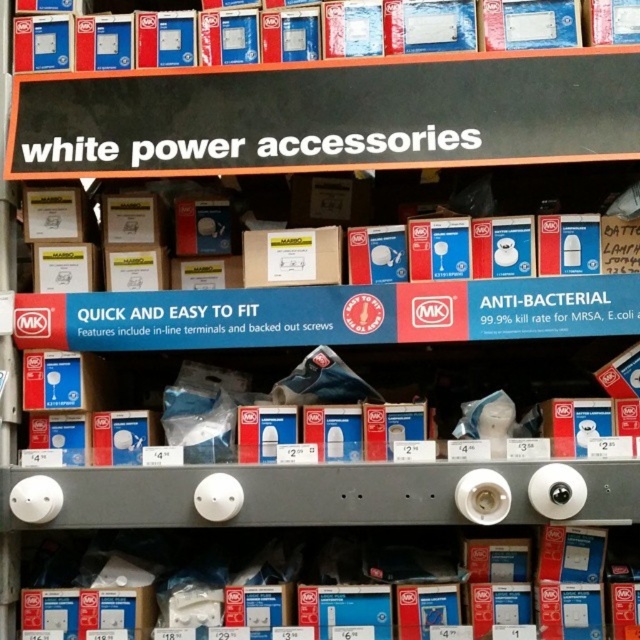
Question: Can you confirm if white plastic light bulb at center is bigger than white cardboard box at center?

Choices:
 (A) yes
 (B) no

Answer: (A)

Question: Among these objects, which one is farthest from the camera?

Choices:
 (A) white cardboard box at center
 (B) black plastic signboard at upper center
 (C) white cardboard boxes at center

Answer: (A)

Question: Can you confirm if black plastic signboard at upper center is positioned to the right of white cardboard boxes at center?

Choices:
 (A) no
 (B) yes

Answer: (A)

Question: Which of the following is the closest to the observer?

Choices:
 (A) (67, 541)
 (B) (269, 228)
 (C) (28, 154)
 (D) (573, 196)

Answer: (C)

Question: Which point is closer to the camera taking this photo?

Choices:
 (A) (604, 580)
 (B) (376, 186)

Answer: (A)

Question: Does white plastic light bulb at center have a larger size compared to white cardboard boxes at center?

Choices:
 (A) no
 (B) yes

Answer: (A)